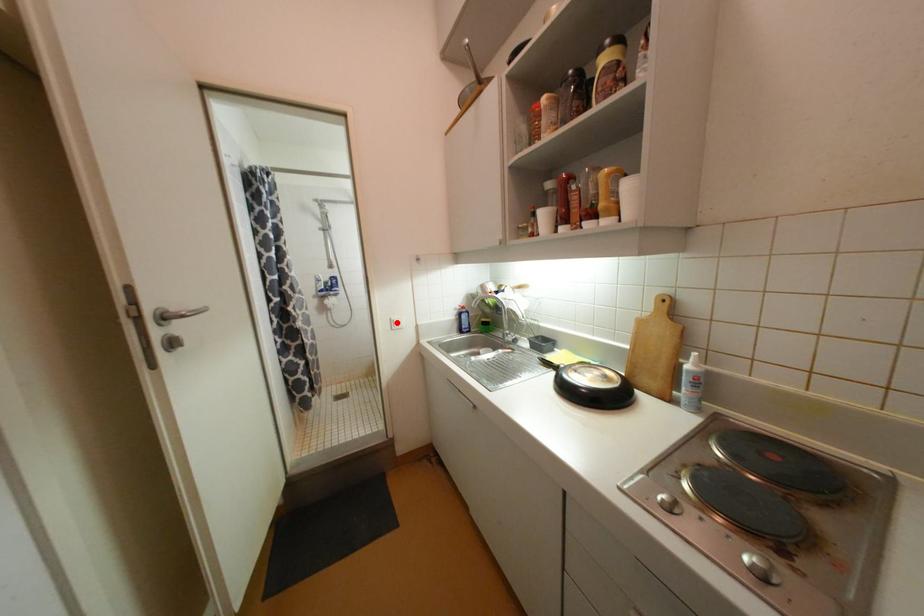
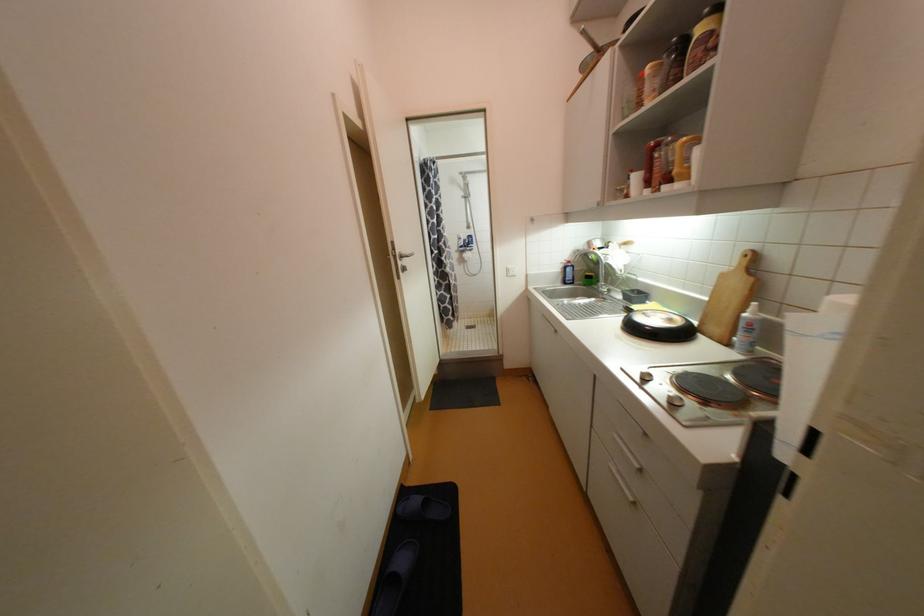
In the second image, find the point that corresponds to the highlighted location in the first image.

(513, 270)